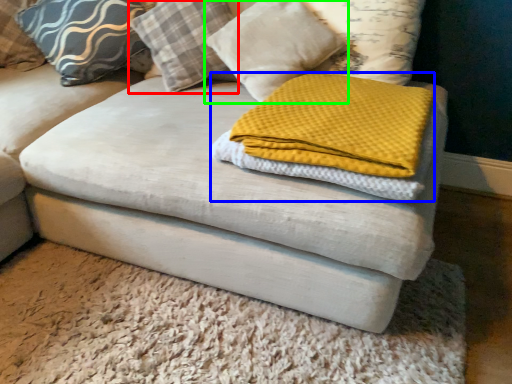
Question: Considering the real-world distances, which object is farthest from pillow (highlighted by a red box)? cloth (highlighted by a blue box) or pillow (highlighted by a green box)?

Choices:
 (A) cloth
 (B) pillow

Answer: (A)